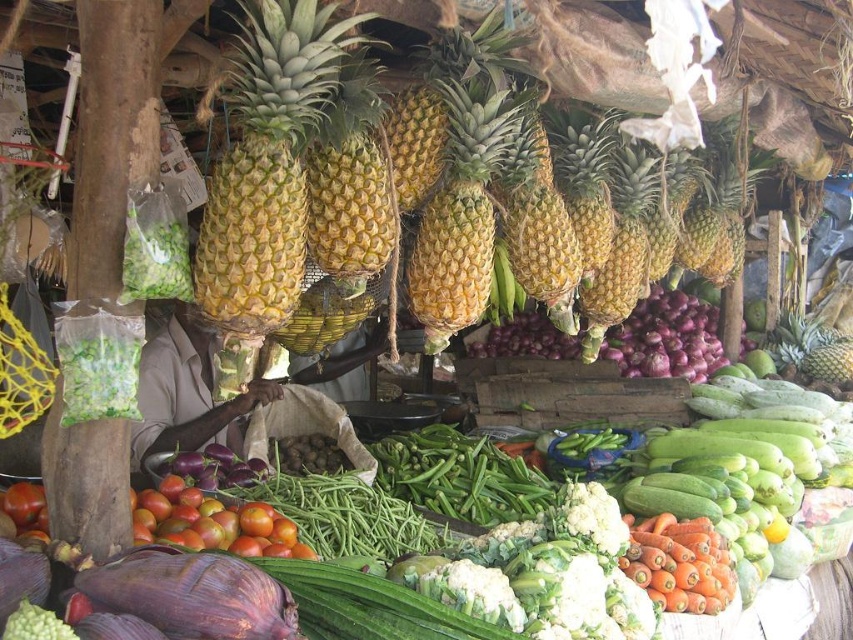
Is yellow-green textured pineapple at center shorter than golden textured pineapple at center?

No.

In order to click on yellow-green textured pineapple at center in this screenshot , I will do `click(267, 163)`.